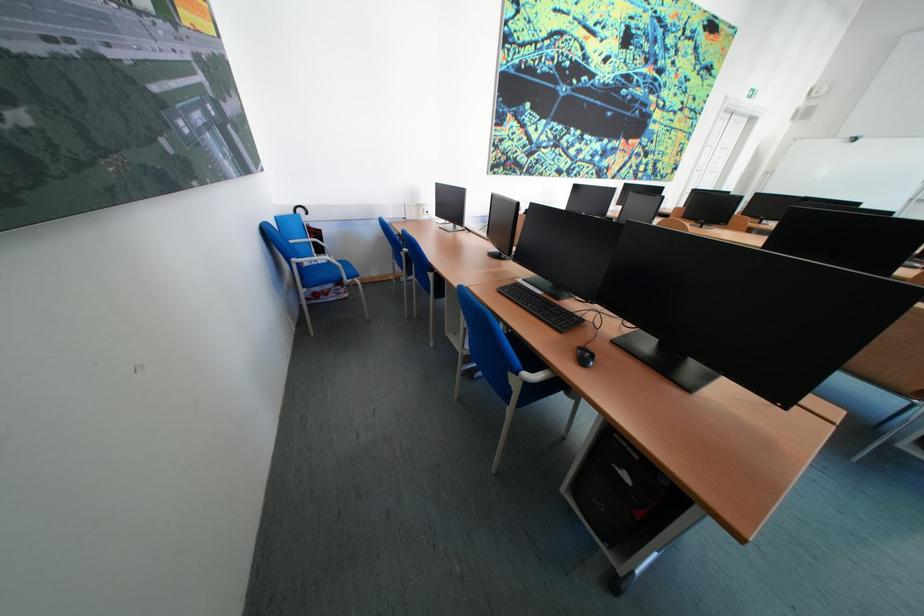
Which object does [584,355] point to?

It corresponds to the black computer mouse in the image.